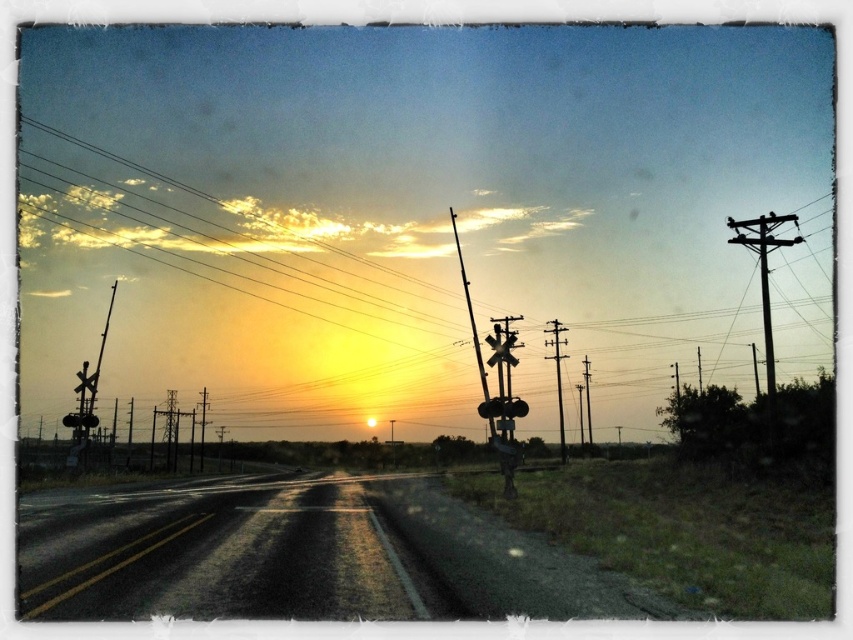
You are driving along the road in this image and need to know if you can see the top of the smooth wood telegraph pole at center right from the position of the black matte traffic light at center. Can you see it?

The smooth wood telegraph pole at center right is much taller than the black matte traffic light at center, so yes, you can see its top from the traffic light position.

You are a painter setting up an easel to paint the sunset scene. You notice the smooth wood telegraph pole at center right and the black matte traffic light at center. Which object would require a wider brush stroke to depict its width accurately?

The black matte traffic light at center requires a wider brush stroke because its width is greater than the smooth wood telegraph pole at center right.

You are driving along the road and see the silhouette wooden pole at right and the smooth wood telegraph pole at center right. Which pole is closer to your car?

The silhouette wooden pole at right is closer to your car because it is positioned in front of the smooth wood telegraph pole at center right.